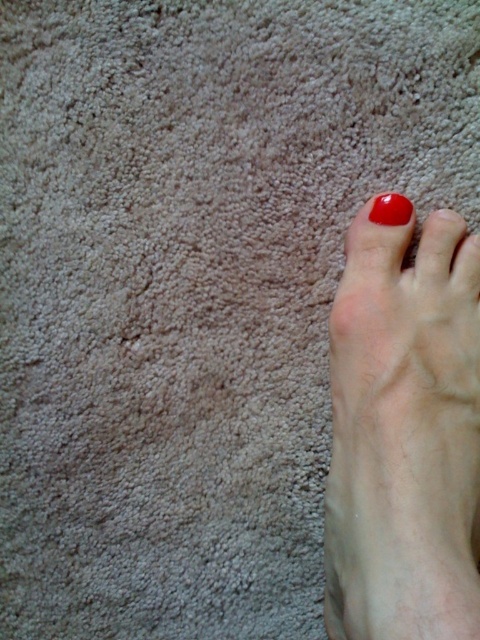
Between smooth skin foot at lower right and glossy red nail at upper right, which one has less height?

glossy red nail at upper right is shorter.

Does smooth skin foot at lower right appear on the left side of glossy red nail at upper right?

Yes, smooth skin foot at lower right is to the left of glossy red nail at upper right.

Is point (384, 340) less distant than point (385, 202)?

That is True.

Identify the location of smooth skin foot at lower right. The height and width of the screenshot is (640, 480). (405, 435).